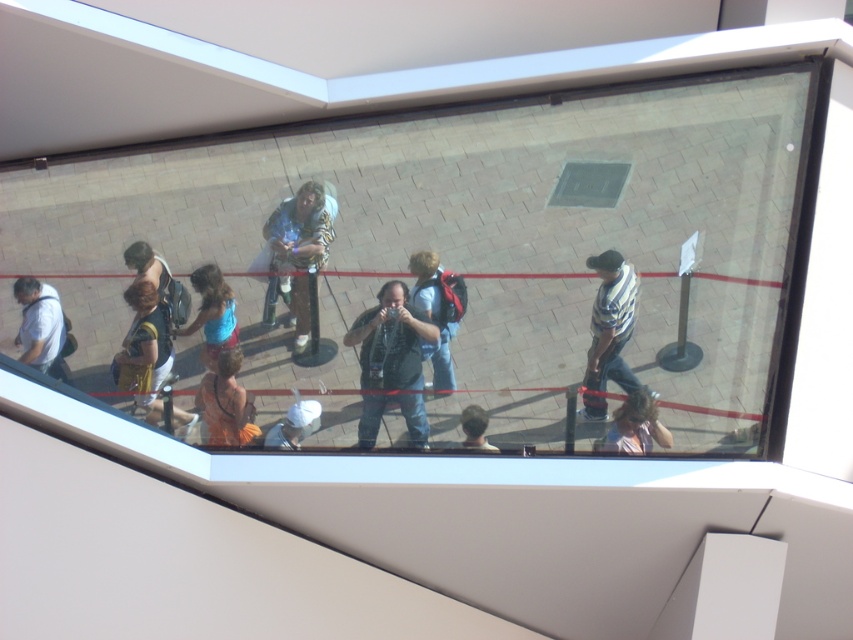
You are standing at the window and want to take a photo of the matte gray shirt at left without the matte black camera at center appearing in the frame. Is it possible to do so by moving your camera slightly to the side?

The matte black camera at center is closer to the viewer than the matte gray shirt at left, so moving your camera to the side might allow you to capture the matte gray shirt at left while avoiding the closer matte black camera at center.

You are a photographer trying to decide which item to use next. You have a matte black camera at center and a matte gray shirt at left. Which item is bigger?

The matte black camera at center is larger in size compared to the matte gray shirt at left.